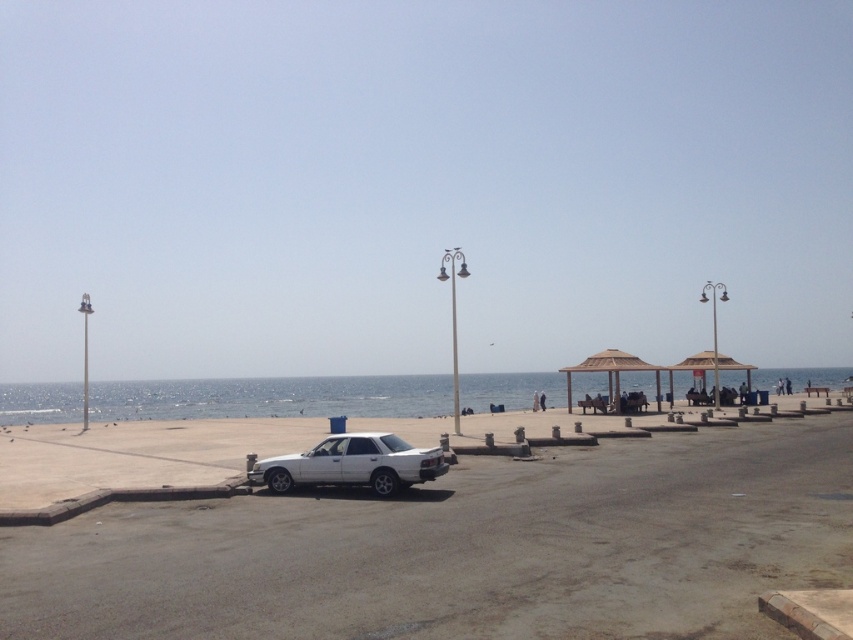
Can you confirm if brown wooden gazebo at center is positioned above brown woven umbrella at center?

Incorrect, brown wooden gazebo at center is not positioned above brown woven umbrella at center.

Find the location of a particular element. The width and height of the screenshot is (853, 640). brown wooden gazebo at center is located at coordinates (611, 372).

Can you confirm if white matte sedan at center is shorter than brown wooden gazebo at center?

Indeed, white matte sedan at center has a lesser height compared to brown wooden gazebo at center.

Between point (369, 481) and point (624, 358), which one is positioned behind?

The point (624, 358) is more distant.

Locate an element on the screen. white matte sedan at center is located at coordinates tap(352, 465).

Can you confirm if white matte sedan at center is smaller than brown woven umbrella at center?

Yes.

Who is positioned more to the right, white matte sedan at center or brown woven umbrella at center?

brown woven umbrella at center is more to the right.

Is point (440, 474) closer to camera compared to point (698, 372)?

Yes, it is.

Locate an element on the screen. This screenshot has height=640, width=853. white matte sedan at center is located at coordinates (352, 465).